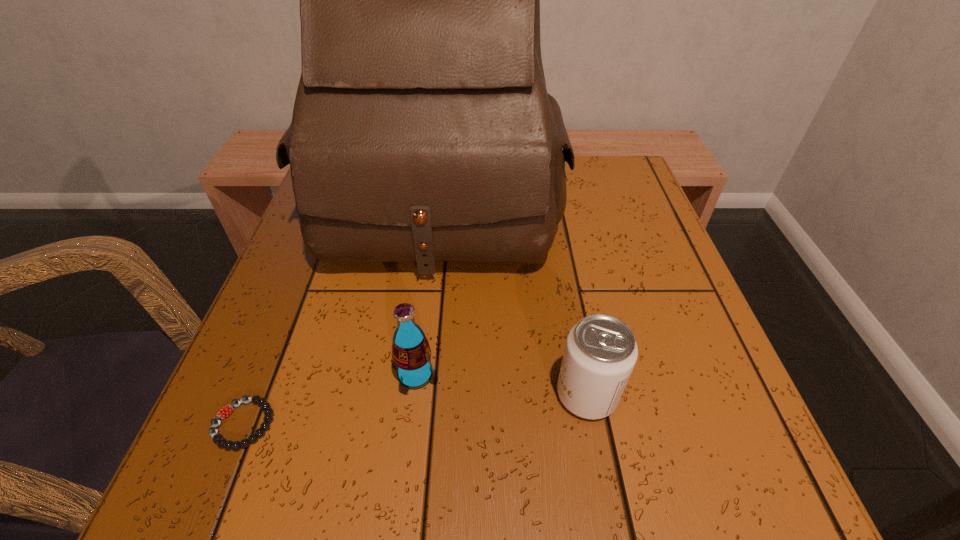
Find the location of a particular element. The height and width of the screenshot is (540, 960). the farthest object is located at coordinates (422, 130).

Find the location of a particular element. Image resolution: width=960 pixels, height=540 pixels. satchel is located at coordinates (422, 130).

Where is `the left soda can`? The image size is (960, 540). the left soda can is located at coordinates (411, 353).

Find the location of a particular element. the right soda can is located at coordinates (600, 353).

The height and width of the screenshot is (540, 960). What are the coordinates of `bracelet` in the screenshot? It's located at (x=224, y=412).

Find the location of a particular element. The height and width of the screenshot is (540, 960). vacant space located 0.090m on the front flap of the tallest object is located at coordinates (426, 322).

Image resolution: width=960 pixels, height=540 pixels. What are the coordinates of `vacant space located on the back of the left soda can` in the screenshot? It's located at (421, 321).

Identify the location of vacant area situated on the back of the right soda can. (556, 230).

The image size is (960, 540). Find the location of `free space located 0.270m on the back of the shortest object`. free space located 0.270m on the back of the shortest object is located at coordinates (305, 271).

What are the coordinates of `object at the far edge` in the screenshot? It's located at (422, 130).